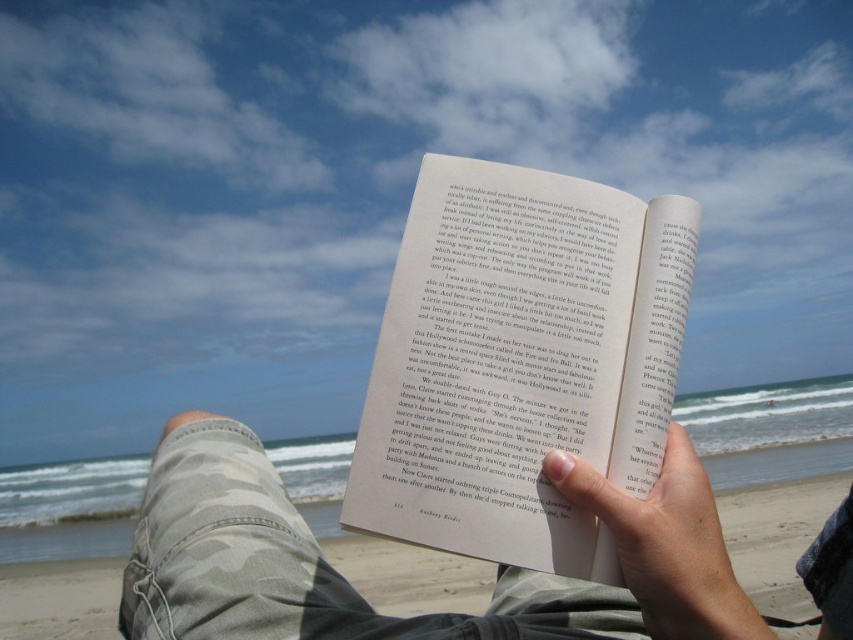
You are a photographer trying to capture the camouflage pants at lower left and the smooth skin hand at center in a single frame. Which object should you focus on first if you want to ensure both are in focus, considering their sizes?

The camouflage pants at lower left is bigger than the smooth skin hand at center, so focusing on the camouflage pants at lower left first will help ensure both are in focus since it occupies more of the frame.

You are organizing a beach cleanup and need to place a small trash bag. You have the matte paper book at center and the camouflage pants at lower left. Which object can the trash bag fit under without moving either item?

The matte paper book at center has a smaller size compared to camouflage pants at lower left, so the trash bag can fit under the camouflage pants at lower left since it is larger.

From the picture: You are standing at the point marked as point (415, 616) and want to walk towards the camouflage pants at lower left. Which direction should you go?

The point (415, 616) is already at the camouflage pants at lower left, so you are already there.